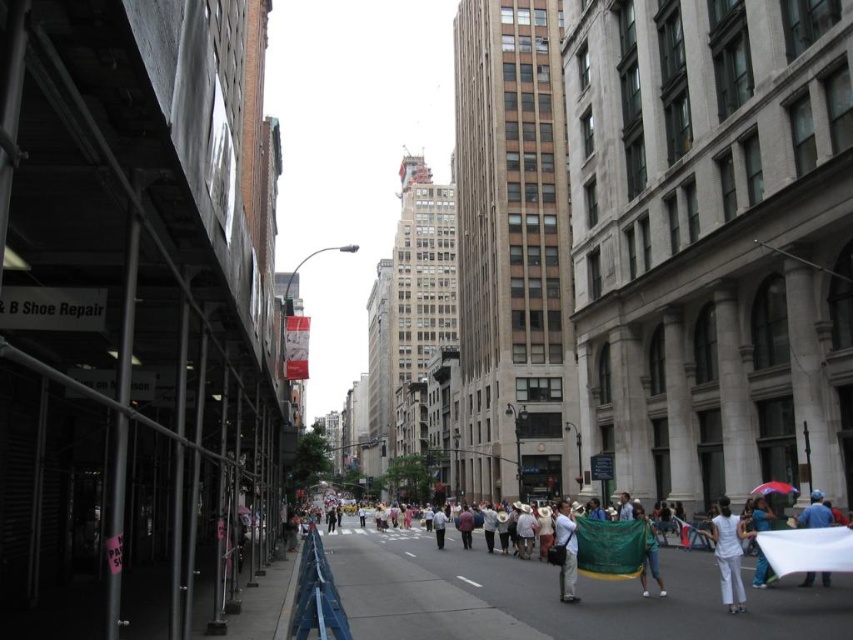
You are a customer in a clothing store and see a white cotton dress at lower right and a blue fabric at center. Which item is positioned closer to the left side of the store?

The white cotton dress at lower right is positioned to the left of the blue fabric at center, so it is closer to the left side of the store.

You are standing on the concrete sidewalk at center and want to reach the white matte umbrella at lower right. Which direction should you move to get closer to the umbrella?

You should move forward because the concrete sidewalk at center is closer to the viewer than the white matte umbrella at lower right, so moving towards the direction of the umbrella would bring you closer.

You are a delivery person with a cart that is 1.2 meters wide. You need to navigate through the street shown in the image. Can your cart fit between the concrete sidewalk at center and the white matte umbrella at lower right without touching either?

The concrete sidewalk at center is wider than the white matte umbrella at lower right. Since the cart is 1.2 meters wide, it can fit between them as long as the total available space between the sidewalk and the umbrella is at least 1.2 meters. However, the exact dimensions aren